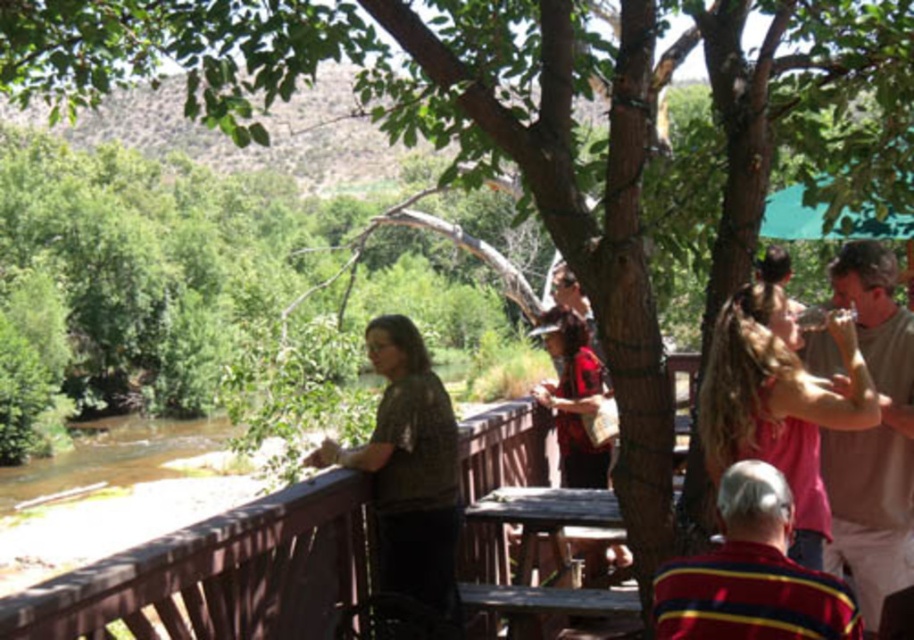
Which is behind, point (299, 604) or point (757, 504)?

The point (299, 604) is more distant.

Can you confirm if brown wood rail at left is smaller than striped cotton shirt at center?

No, brown wood rail at left is not smaller than striped cotton shirt at center.

Who is more distant from viewer, (282, 620) or (741, 563)?

The point (282, 620) is behind.

This screenshot has width=914, height=640. Identify the location of brown wood rail at left. (220, 573).

I want to click on pink fabric shirt at upper right, so click(x=779, y=403).

Between pink fabric shirt at upper right and striped cotton shirt at center, which one has less height?

Standing shorter between the two is striped cotton shirt at center.

This screenshot has width=914, height=640. What do you see at coordinates (779, 403) in the screenshot?
I see `pink fabric shirt at upper right` at bounding box center [779, 403].

You are a GUI agent. You are given a task and a screenshot of the screen. Output one action in this format:
    pyautogui.click(x=<x>, y=<y>)
    Task: Click on the pink fabric shirt at upper right
    This screenshot has height=640, width=914.
    Given the screenshot: What is the action you would take?
    pyautogui.click(x=779, y=403)

Does pink fabric shirt at upper right lie in front of textured brown shirt at left?

That is True.

Between pink fabric shirt at upper right and textured brown shirt at left, which one has less height?

textured brown shirt at left is shorter.

You are a GUI agent. You are given a task and a screenshot of the screen. Output one action in this format:
    pyautogui.click(x=<x>, y=<y>)
    Task: Click on the pink fabric shirt at upper right
    
    Given the screenshot: What is the action you would take?
    pyautogui.click(x=779, y=403)

Where is `pink fabric shirt at upper right`? Image resolution: width=914 pixels, height=640 pixels. pink fabric shirt at upper right is located at coordinates (779, 403).